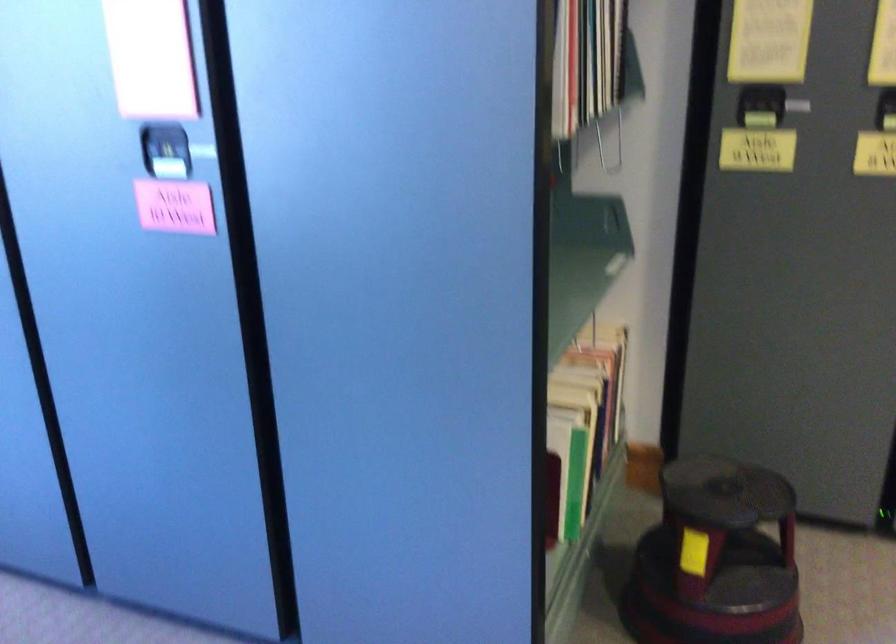
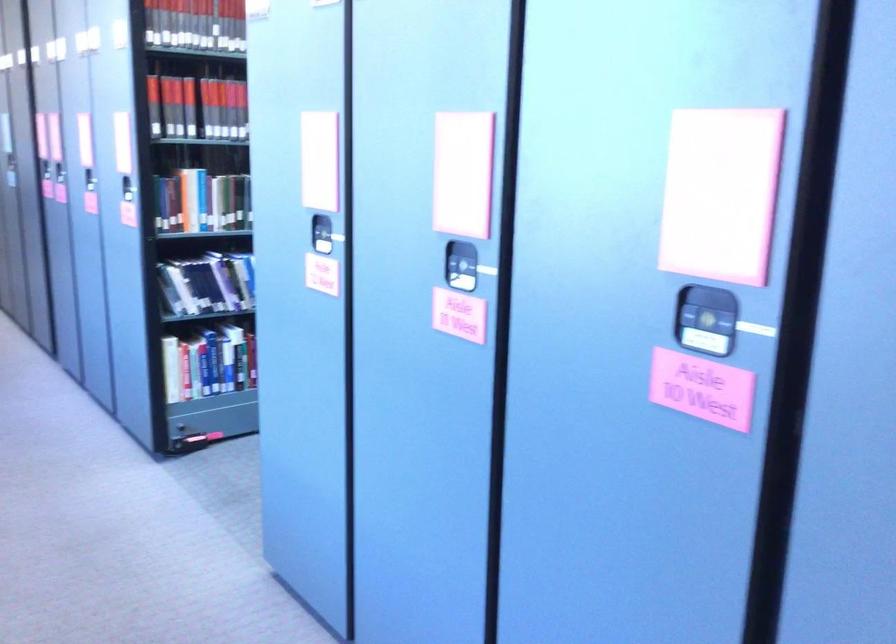
Question: Based on the continuous images, in which direction is the camera rotating? Reply with the corresponding letter.

Choices:
 (A) Left
 (B) Right
 (C) Up
 (D) Down

Answer: (A)